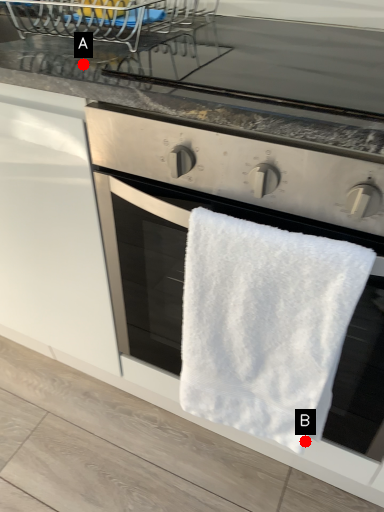
Question: Two points are circled on the image, labeled by A and B beside each circle. Which point is closer to the camera taking this photo?

Choices:
 (A) A is closer
 (B) B is closer

Answer: (A)